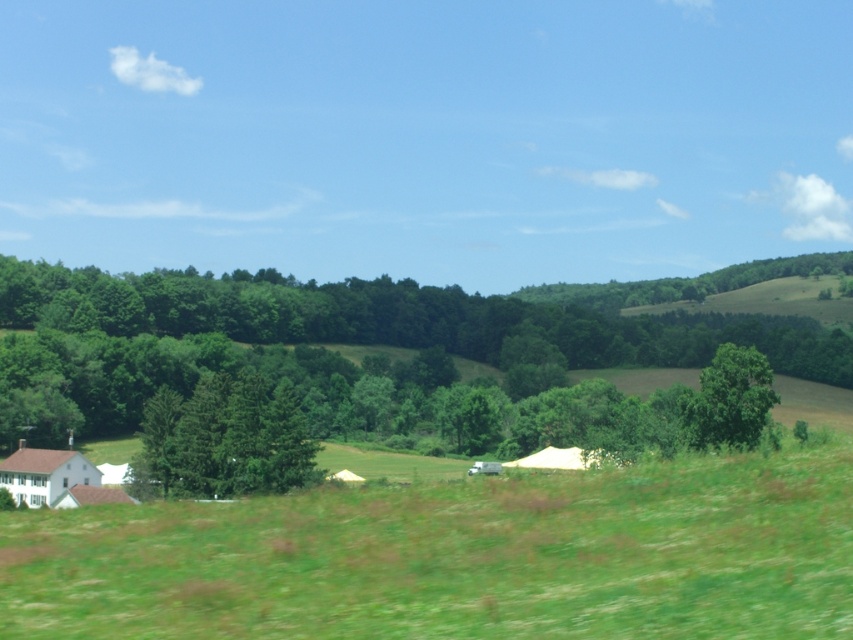
You are planning to set up a picnic at the center of the image. There is a green matte tree at center and a white fabric tent at center. Which object is closer to the left edge of the image?

Answer: The green matte tree at center is to the left of the white fabric tent at center, so it is closer to the left edge of the image.